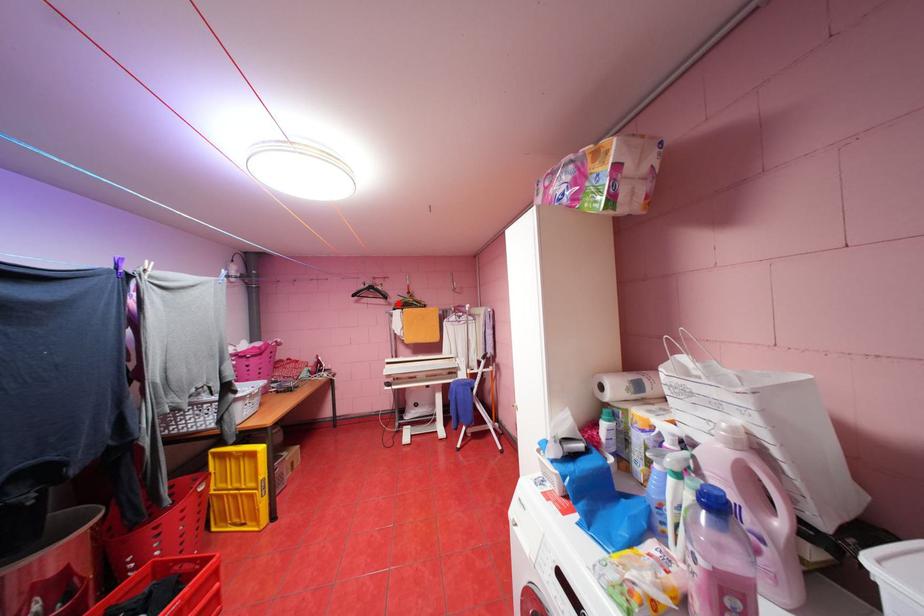
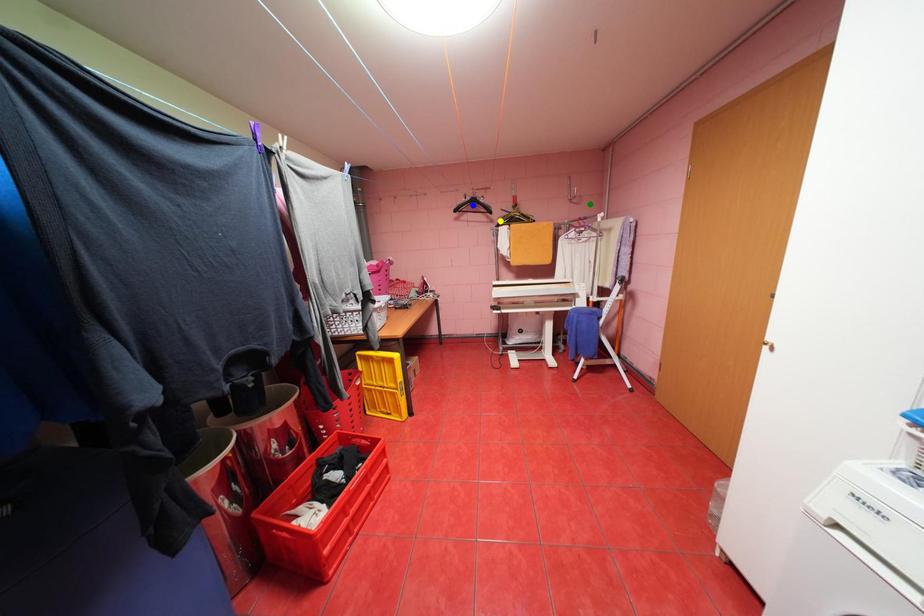
Question: I am providing you with two images of the same scene from different viewpoints. A red point is marked on the first image. You are given multiple points on the second image. Which mark in image 2 goes with the point in image 1?

Choices:
 (A) blue point
 (B) yellow point
 (C) green point

Answer: (B)